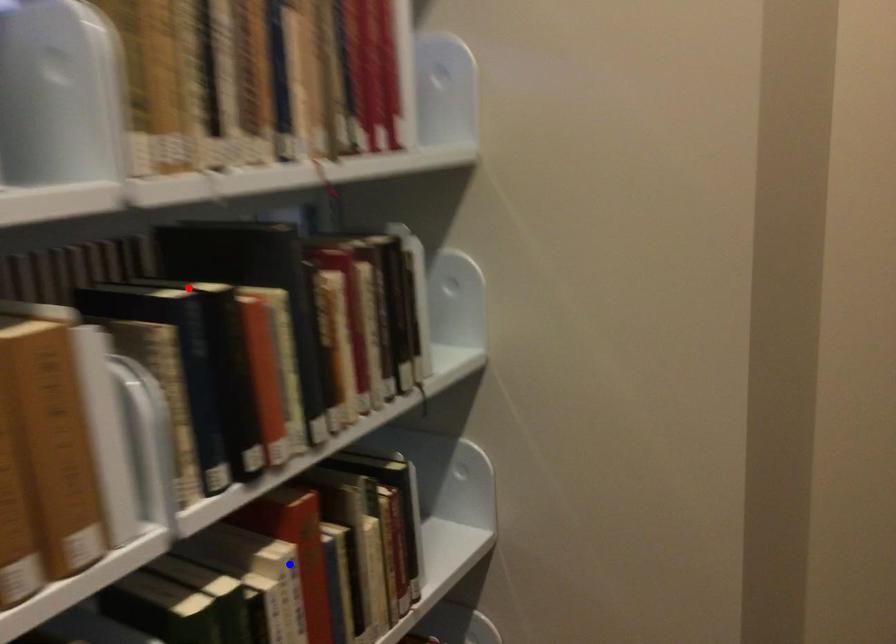
Question: In the image, two points are highlighted. Which point is nearer to the camera? Reply with the corresponding letter.

Choices:
 (A) blue point
 (B) red point

Answer: (B)